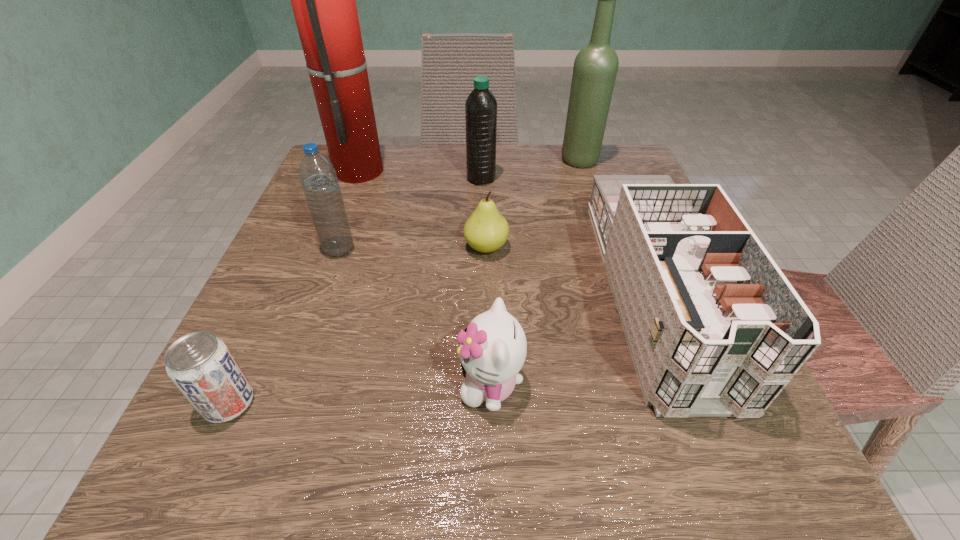
Find the location of a particular element. the tallest object is located at coordinates (323, 0).

Where is `the seventh shortest object`? This screenshot has width=960, height=540. the seventh shortest object is located at coordinates (595, 68).

Find the location of a particular element. This screenshot has width=960, height=540. the farther water bottle is located at coordinates (481, 106).

Locate an element on the screen. Image resolution: width=960 pixels, height=540 pixels. the nearer water bottle is located at coordinates (318, 177).

I want to click on dollhouse, so click(715, 329).

The width and height of the screenshot is (960, 540). Identify the location of kitten. (493, 348).

Locate an element on the screen. This screenshot has width=960, height=540. pear is located at coordinates (486, 230).

I want to click on soda can, so click(x=202, y=367).

At what (x,y) coordinates should I click in order to perform the action: click on free region located 0.400m with the nozzle and gauge on the tallest object. Please return your answer as a coordinate pair (x, y). Looking at the image, I should click on (559, 169).

You are a GUI agent. You are given a task and a screenshot of the screen. Output one action in this format:
    pyautogui.click(x=<x>, y=<y>)
    Task: Click on the vacant area located on the left of the second tallest object
    
    Given the screenshot: What is the action you would take?
    pyautogui.click(x=518, y=160)